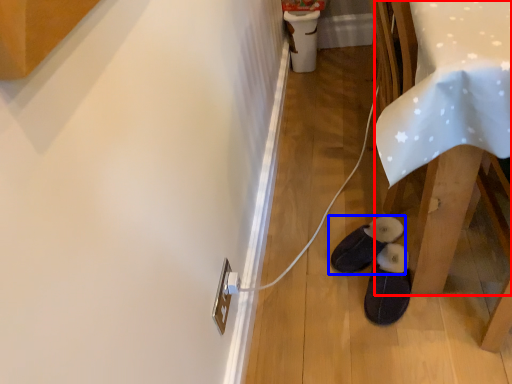
Question: Which object is further to the camera taking this photo, table (highlighted by a red box) or footwear (highlighted by a blue box)?

Choices:
 (A) table
 (B) footwear

Answer: (B)